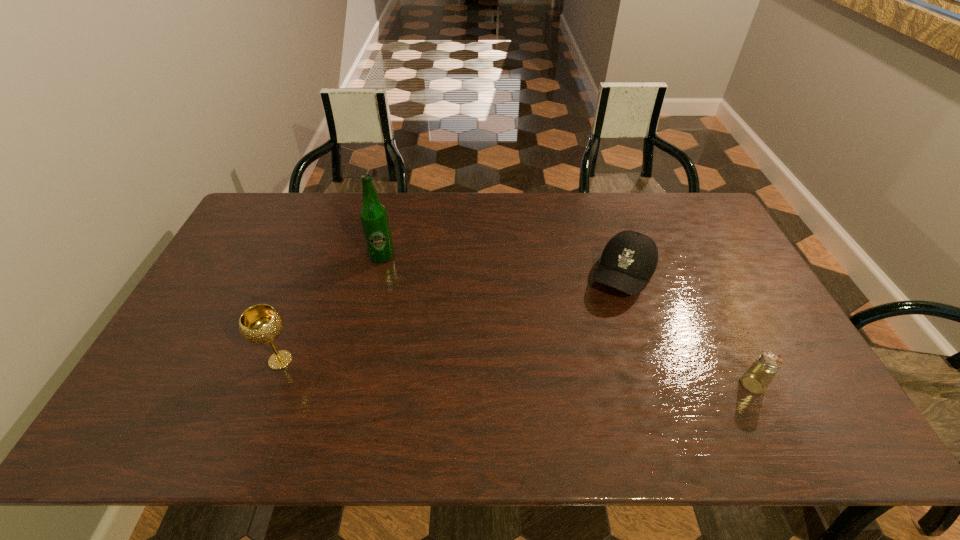
Identify the location of free spot located 0.320m on the label of the third object from right to left. This screenshot has height=540, width=960. (465, 313).

Locate an element on the screen. free spot located on the front-facing side of the baseball cap is located at coordinates (575, 373).

The width and height of the screenshot is (960, 540). I want to click on vacant space situated 0.070m on the front-facing side of the baseball cap, so click(604, 318).

Locate an element on the screen. vacant space situated 0.270m on the front-facing side of the baseball cap is located at coordinates (577, 370).

Where is `chalice at the near edge`? chalice at the near edge is located at coordinates (260, 324).

Where is `saltshaker present at the near edge`? This screenshot has width=960, height=540. saltshaker present at the near edge is located at coordinates (756, 379).

This screenshot has width=960, height=540. In order to click on object that is at the right edge in this screenshot , I will do `click(756, 379)`.

Where is `object positioned at the near right corner`? object positioned at the near right corner is located at coordinates (756, 379).

The image size is (960, 540). I want to click on vacant region at the far edge, so click(536, 221).

I want to click on blank space at the near edge, so click(723, 374).